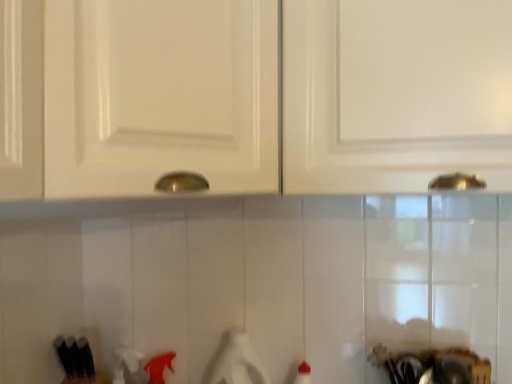
What do you see at coordinates (253, 95) in the screenshot? I see `white matte cabinet at center` at bounding box center [253, 95].

Locate an element on the screen. The image size is (512, 384). white matte cabinet at center is located at coordinates (253, 95).

Where is `white matte cabinet at center`? This screenshot has height=384, width=512. white matte cabinet at center is located at coordinates coord(253,95).